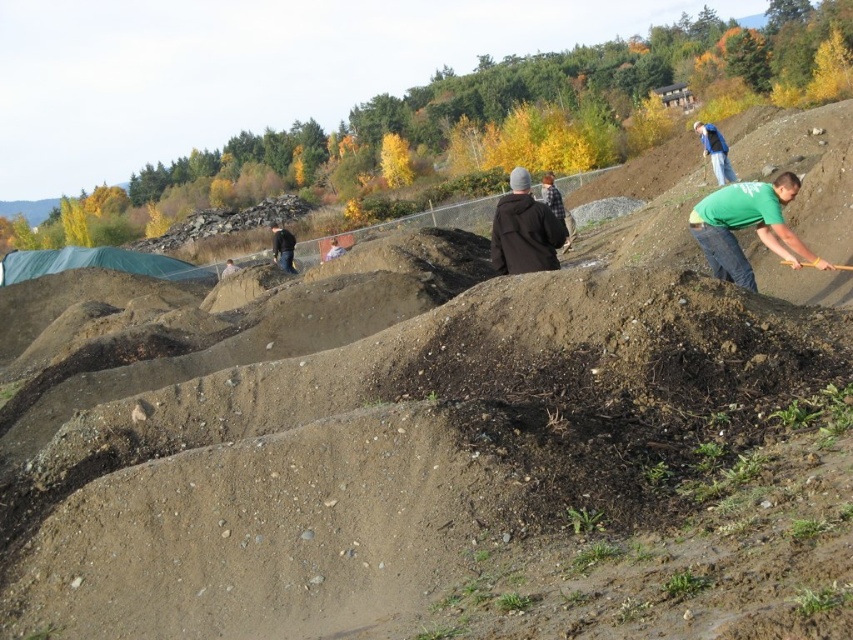
Looking at this image, can you confirm if green matte shirt at right is smaller than light brown leather jacket at center?

Yes, green matte shirt at right is smaller than light brown leather jacket at center.

Is green matte shirt at right below light brown leather jacket at center?

Indeed, green matte shirt at right is positioned under light brown leather jacket at center.

What do you see at coordinates (747, 225) in the screenshot? I see `green matte shirt at right` at bounding box center [747, 225].

Image resolution: width=853 pixels, height=640 pixels. I want to click on green matte shirt at right, so click(x=747, y=225).

Can you confirm if blue denim jeans at right is thinner than black fabric at center?

In fact, blue denim jeans at right might be wider than black fabric at center.

Between point (706, 129) and point (231, 262), which one is positioned behind?

Positioned behind is point (231, 262).

Between point (715, 173) and point (229, 262), which one is positioned in front?

Point (715, 173) is in front.

This screenshot has width=853, height=640. In order to click on blue denim jeans at right in this screenshot , I will do `click(715, 150)`.

Which is more to the left, green matte shirt at right or wooden shovel at right?

Positioned to the left is green matte shirt at right.

Who is more forward, (724, 234) or (844, 266)?

Point (724, 234)

Between point (793, 195) and point (786, 260), which one is positioned in front?

Positioned in front is point (793, 195).

Locate an element on the screen. The width and height of the screenshot is (853, 640). green matte shirt at right is located at coordinates (747, 225).